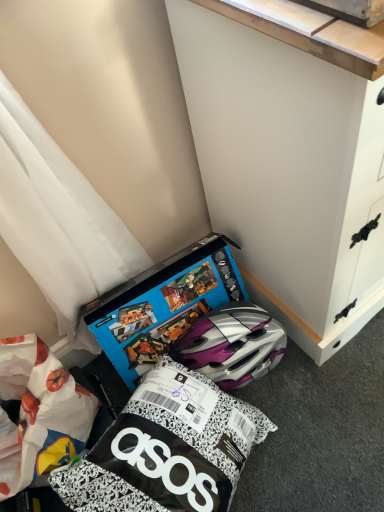
What is the approximate width of blue cardboard box at lower center?

blue cardboard box at lower center is 8.87 inches in width.

The image size is (384, 512). Describe the element at coordinates (163, 304) in the screenshot. I see `blue cardboard box at lower center` at that location.

I want to click on blue cardboard box at lower center, so click(x=163, y=304).

Describe the element at coordinates (287, 172) in the screenshot. I see `white painted wood cabinet at lower right` at that location.

Locate an element on the screen. white painted wood cabinet at lower right is located at coordinates (287, 172).

What are the coordinates of `blue cardboard box at lower center` in the screenshot? It's located at (163, 304).

Considering the positions of objects white painted wood cabinet at lower right and blue cardboard box at lower center in the image provided, who is more to the left, white painted wood cabinet at lower right or blue cardboard box at lower center?

Positioned to the left is blue cardboard box at lower center.

Considering the positions of objects white painted wood cabinet at lower right and blue cardboard box at lower center in the image provided, who is behind, white painted wood cabinet at lower right or blue cardboard box at lower center?

Positioned behind is blue cardboard box at lower center.

Considering the points (326, 108) and (190, 276), which point is behind, point (326, 108) or point (190, 276)?

The point (190, 276) is farther.

From the image's perspective, which one is positioned higher, white painted wood cabinet at lower right or blue cardboard box at lower center?

white painted wood cabinet at lower right appears higher in the image.

From a real-world perspective, is white painted wood cabinet at lower right positioned under blue cardboard box at lower center based on gravity?

No, from a real-world perspective, white painted wood cabinet at lower right is not below blue cardboard box at lower center.

Considering the relative sizes of white painted wood cabinet at lower right and blue cardboard box at lower center in the image provided, is white painted wood cabinet at lower right wider than blue cardboard box at lower center?

Yes, white painted wood cabinet at lower right is wider than blue cardboard box at lower center.

Considering the sizes of objects white painted wood cabinet at lower right and blue cardboard box at lower center in the image provided, who is shorter, white painted wood cabinet at lower right or blue cardboard box at lower center?

blue cardboard box at lower center is shorter.

Is white painted wood cabinet at lower right bigger than blue cardboard box at lower center?

Yes, white painted wood cabinet at lower right is bigger than blue cardboard box at lower center.

Is white painted wood cabinet at lower right completely or partially outside of blue cardboard box at lower center?

white painted wood cabinet at lower right is positioned outside blue cardboard box at lower center.

Is white painted wood cabinet at lower right far away from blue cardboard box at lower center?

No, white painted wood cabinet at lower right is in close proximity to blue cardboard box at lower center.

Is white painted wood cabinet at lower right oriented towards blue cardboard box at lower center?

No, white painted wood cabinet at lower right is not facing towards blue cardboard box at lower center.

Can you tell me how much white painted wood cabinet at lower right and blue cardboard box at lower center differ in facing direction?

The angle between the facing direction of white painted wood cabinet at lower right and the facing direction of blue cardboard box at lower center is 1.06 degrees.

In the scene shown: How distant is white painted wood cabinet at lower right from blue cardboard box at lower center?

white painted wood cabinet at lower right is 11.40 inches from blue cardboard box at lower center.

Image resolution: width=384 pixels, height=512 pixels. In the image, there is a white painted wood cabinet at lower right. In order to click on box below it (from a real-world perspective) in this screenshot , I will do `click(163, 304)`.

Is blue cardboard box at lower center to the right of white painted wood cabinet at lower right from the viewer's perspective?

No.

Between blue cardboard box at lower center and white painted wood cabinet at lower right, which one is positioned behind?

blue cardboard box at lower center is more distant.

Is point (135, 369) farther from camera compared to point (247, 27)?

Yes.

From the image's perspective, which one is positioned higher, blue cardboard box at lower center or white painted wood cabinet at lower right?

white painted wood cabinet at lower right appears higher in the image.

Consider the image. From a real-world perspective, is blue cardboard box at lower center on white painted wood cabinet at lower right?

No.

Considering the sizes of objects blue cardboard box at lower center and white painted wood cabinet at lower right in the image provided, who is wider, blue cardboard box at lower center or white painted wood cabinet at lower right?

white painted wood cabinet at lower right is wider.

Between blue cardboard box at lower center and white painted wood cabinet at lower right, which one has more height?

Standing taller between the two is white painted wood cabinet at lower right.

Considering the relative sizes of blue cardboard box at lower center and white painted wood cabinet at lower right in the image provided, is blue cardboard box at lower center bigger than white painted wood cabinet at lower right?

No, blue cardboard box at lower center is not bigger than white painted wood cabinet at lower right.

Is blue cardboard box at lower center outside of white painted wood cabinet at lower right?

Yes.

Is there a large distance between blue cardboard box at lower center and white painted wood cabinet at lower right?

That's not correct — blue cardboard box at lower center is a little close to white painted wood cabinet at lower right.

Is blue cardboard box at lower center facing towards white painted wood cabinet at lower right?

Answer: No.

Locate an element on the screen. Image resolution: width=384 pixels, height=512 pixels. box below the white painted wood cabinet at lower right (from the image's perspective) is located at coordinates tap(163, 304).

Identify the location of box behind the white painted wood cabinet at lower right. (163, 304).

You are a GUI agent. You are given a task and a screenshot of the screen. Output one action in this format:
    pyautogui.click(x=<x>, y=<y>)
    Task: Click on the cabinetry on the right of the blue cardboard box at lower center
    
    Given the screenshot: What is the action you would take?
    pyautogui.click(x=287, y=172)